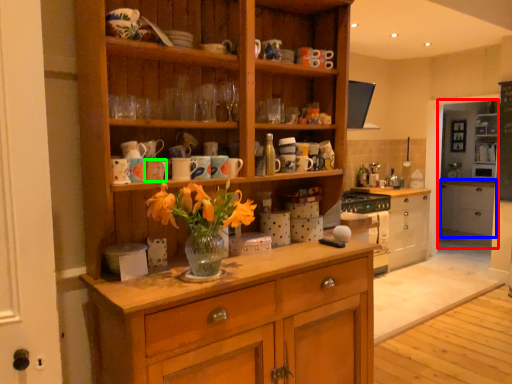
Question: Estimate the real-world distances between objects in this image. Which object is closer to shelf (highlighted by a red box), cabinetry (highlighted by a blue box) or mug (highlighted by a green box)?

Choices:
 (A) cabinetry
 (B) mug

Answer: (A)